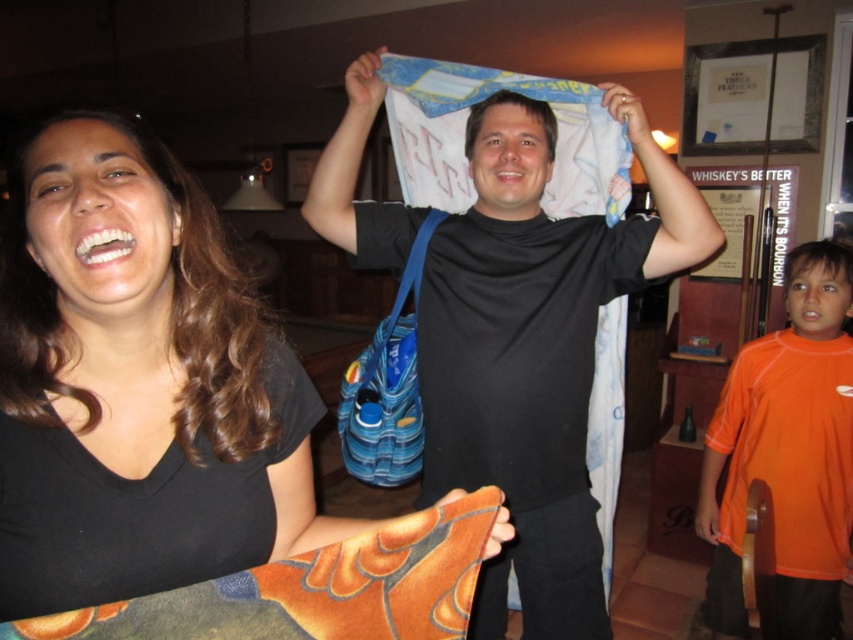
Is white fabric at center in front of orange jersey at right?

Yes, white fabric at center is closer to the viewer.

Is white fabric at center to the right of orange jersey at right from the viewer's perspective?

No, white fabric at center is not to the right of orange jersey at right.

Locate an element on the screen. The image size is (853, 640). white fabric at center is located at coordinates (535, 349).

Where is `white fabric at center`? white fabric at center is located at coordinates (535, 349).

Describe the element at coordinates (137, 384) in the screenshot. I see `matte black shirt at left` at that location.

Is point (70, 483) less distant than point (842, 404)?

Yes, it is.

In order to click on matte black shirt at left in this screenshot , I will do `click(137, 384)`.

Does matte black shirt at left have a larger size compared to white fabric at center?

Actually, matte black shirt at left might be smaller than white fabric at center.

Measure the distance between point [258,468] and camera.

The distance of point [258,468] from camera is 75.51 centimeters.

Who is more distant from viewer, (157, 412) or (442, 445)?

The point (442, 445) is more distant.

This screenshot has width=853, height=640. I want to click on matte black shirt at left, so click(x=137, y=384).